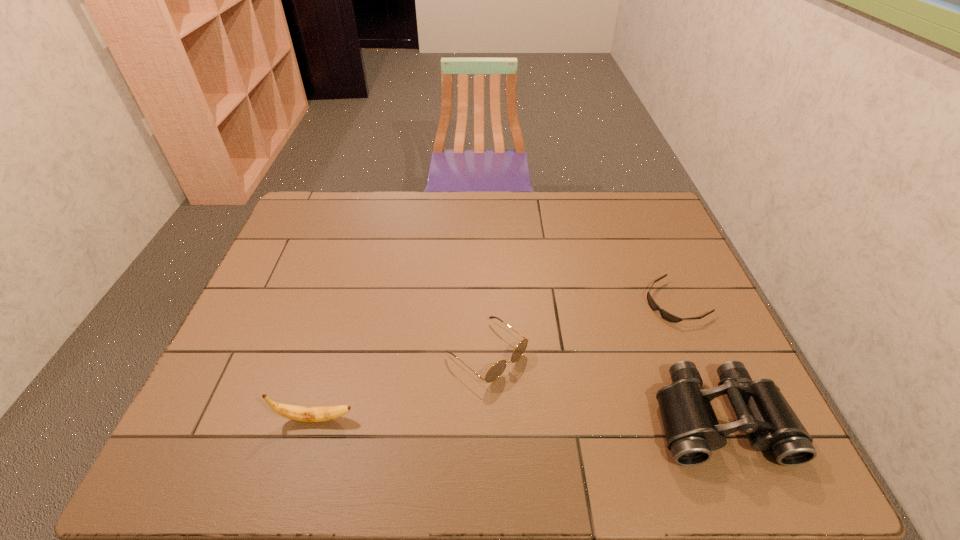
At what (x,y) coordinates should I click in order to perform the action: click on free area in between the binoculars and the banana. Please return your answer as a coordinate pair (x, y). Looking at the image, I should click on (516, 418).

This screenshot has height=540, width=960. What are the coordinates of `empty location between the banana and the binoculars` in the screenshot? It's located at (516, 418).

Image resolution: width=960 pixels, height=540 pixels. I want to click on free spot between the leftmost object and the shorter sunglasses, so click(495, 360).

Select which object is the third closest to the left sunglasses. Please provide its 2D coordinates. Your answer should be formatted as a tuple, i.e. [(x, y)], where the tuple contains the x and y coordinates of a point satisfying the conditions above.

[(665, 315)]

The height and width of the screenshot is (540, 960). I want to click on object identified as the second closest to the shorter sunglasses, so click(x=497, y=369).

You are a GUI agent. You are given a task and a screenshot of the screen. Output one action in this format:
    pyautogui.click(x=<x>, y=<y>)
    Task: Click on the free space in the image that satisfies the following two spatial constraints: 1. on the back side of the second object from left to right; 2. on the right side of the shorter sunglasses
    This screenshot has height=540, width=960.
    Given the screenshot: What is the action you would take?
    pyautogui.click(x=486, y=302)